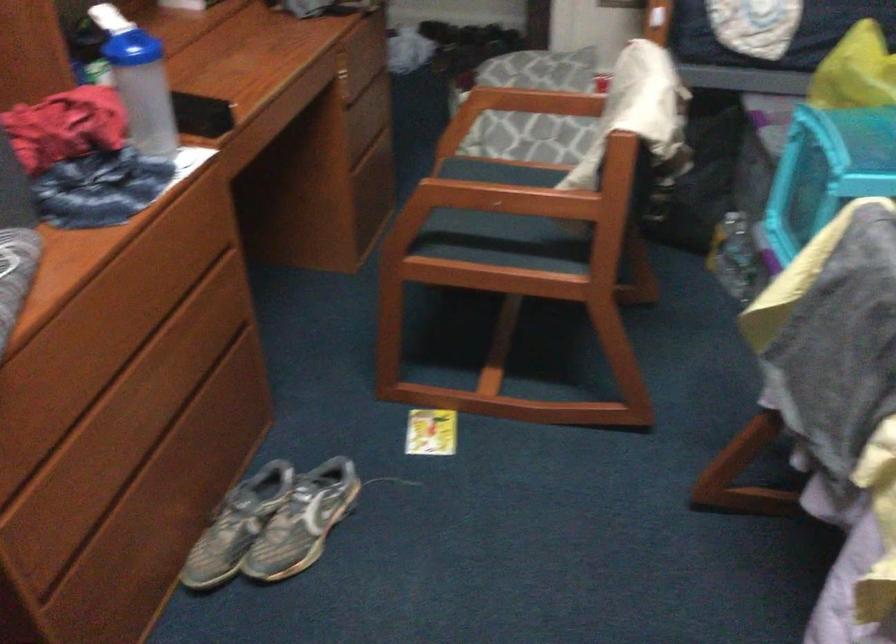
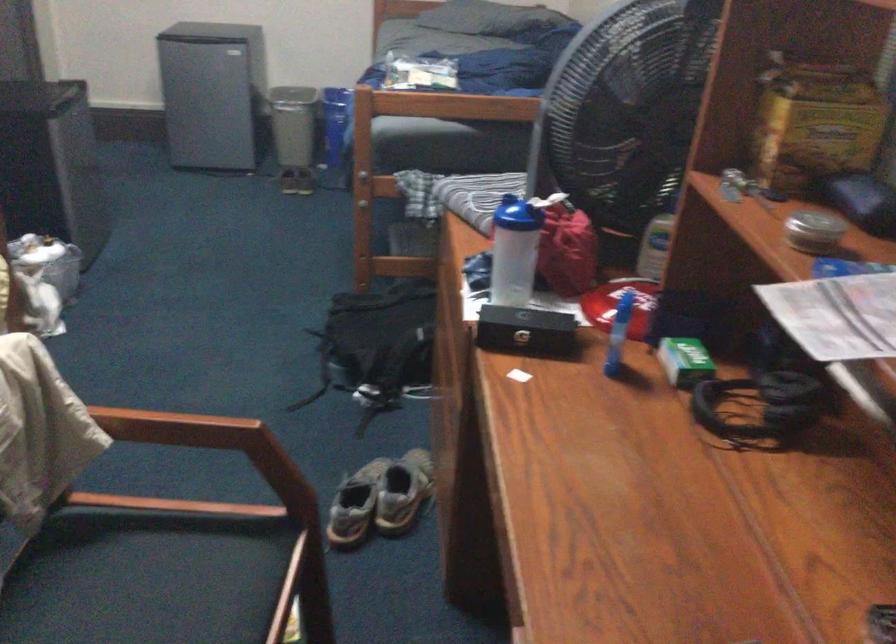
The point at [500,182] is marked in the first image. Where is the corresponding point in the second image?

(176, 428)